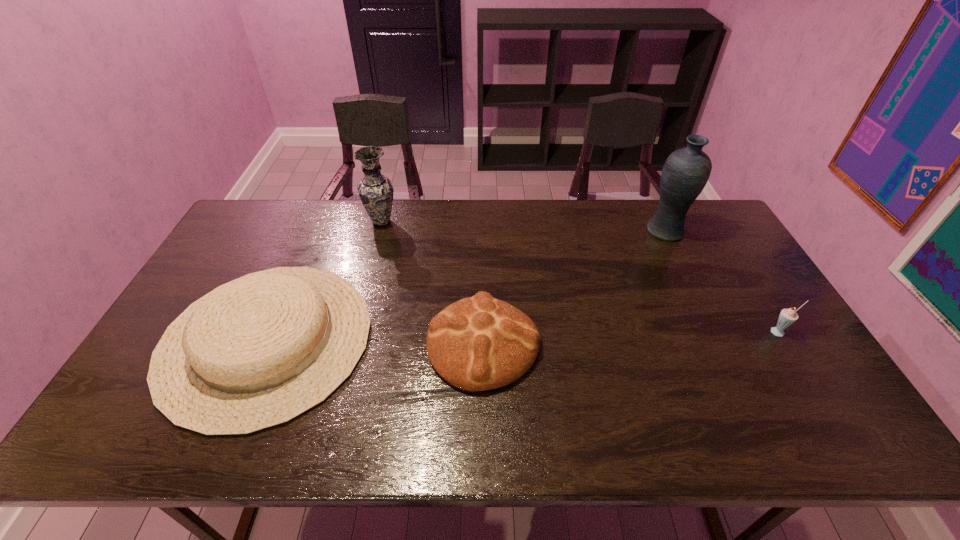
This screenshot has height=540, width=960. In order to click on vacant area situated 0.320m on the right of the bread in this screenshot , I will do `click(660, 344)`.

Identify the location of free space located 0.390m on the right of the sunhat. This screenshot has height=540, width=960. (514, 340).

Locate an element on the screen. Image resolution: width=960 pixels, height=540 pixels. object located in the near edge section of the desktop is located at coordinates (257, 352).

Identify the location of object located in the left edge section of the desktop. point(257,352).

Locate an element on the screen. This screenshot has width=960, height=540. vase present at the right edge is located at coordinates (686, 171).

Find the location of a particular element. This screenshot has height=540, width=960. milkshake that is at the right edge is located at coordinates (787, 317).

Where is `object positioned at the near left corner`? object positioned at the near left corner is located at coordinates (257, 352).

Locate an element on the screen. This screenshot has height=540, width=960. object situated at the far right corner is located at coordinates (686, 171).

In the image, there is a desktop. Where is `vacant space at the far edge`? vacant space at the far edge is located at coordinates (324, 210).

The width and height of the screenshot is (960, 540). Identify the location of vacant space at the left edge. (x=242, y=254).